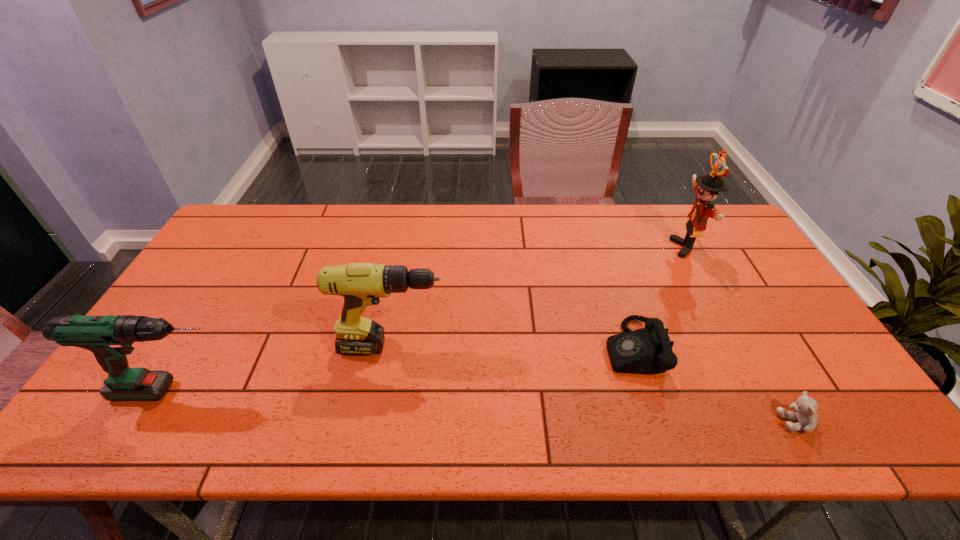
You are a GUI agent. You are given a task and a screenshot of the screen. Output one action in this format:
    pyautogui.click(x=<x>, y=<y>)
    Task: Click on the object positioned at the near edge
    This screenshot has height=540, width=960.
    Given the screenshot: What is the action you would take?
    pyautogui.click(x=805, y=407)

You are a GUI agent. You are given a task and a screenshot of the screen. Output one action in this format:
    pyautogui.click(x=<x>, y=<y>)
    Task: Click on the object positioned at the left edge
    
    Given the screenshot: What is the action you would take?
    pyautogui.click(x=110, y=337)

At what (x,y) coordinates should I click in order to perform the action: click on nutcracker located at the right edge. Please return your answer as a coordinate pair (x, y). This screenshot has width=960, height=540. Looking at the image, I should click on (706, 187).

The height and width of the screenshot is (540, 960). In order to click on teddy bear that is at the right edge in this screenshot , I will do `click(805, 407)`.

You are a GUI agent. You are given a task and a screenshot of the screen. Output one action in this format:
    pyautogui.click(x=<x>, y=<y>)
    Task: Click on the object present at the far right corner
    This screenshot has height=540, width=960.
    Given the screenshot: What is the action you would take?
    pyautogui.click(x=706, y=187)

Image resolution: width=960 pixels, height=540 pixels. Find the location of `object that is at the near right corner`. object that is at the near right corner is located at coordinates (805, 407).

Where is `vacant space at the far edge`? vacant space at the far edge is located at coordinates click(x=313, y=244).

Locate an element on the screen. vacant space at the near edge of the desktop is located at coordinates (485, 425).

What are the coordinates of `vacant space at the left edge of the desktop` in the screenshot? It's located at (204, 300).

Image resolution: width=960 pixels, height=540 pixels. I want to click on vacant space at the right edge of the desktop, so click(x=758, y=344).